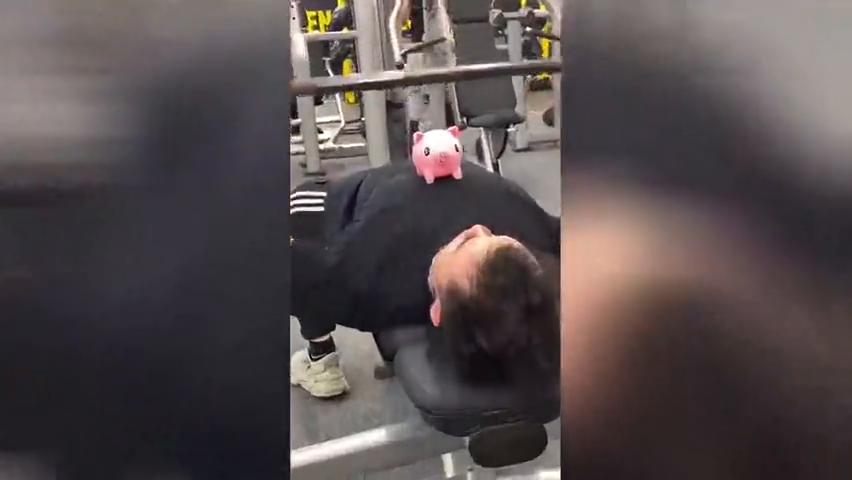
Find the location of `exercise machine`. exercise machine is located at coordinates (479, 98).